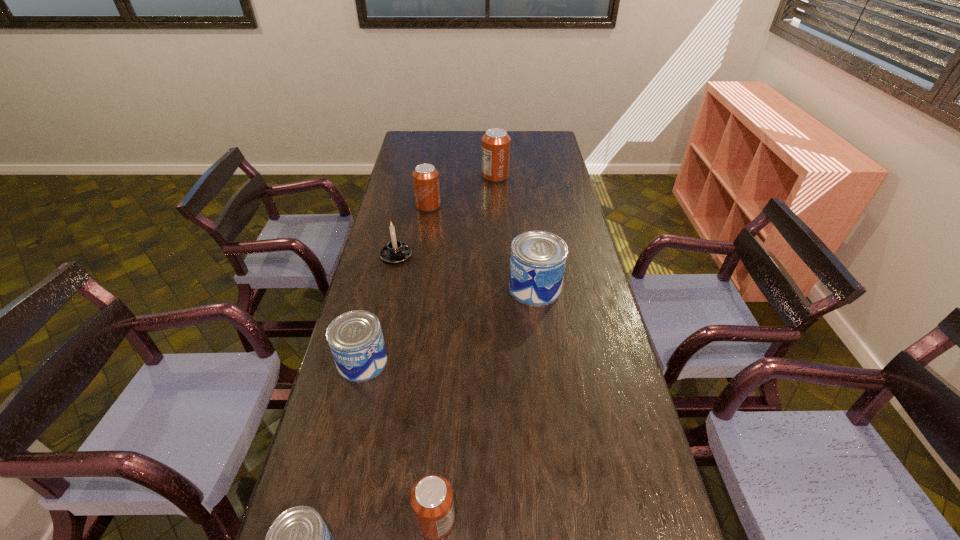
Point out which orange can is positioned as the fourth nearest to the nearest blue can. Please provide its 2D coordinates. Your answer should be formatted as a tuple, i.e. [(x, y)], where the tuple contains the x and y coordinates of a point satisfying the conditions above.

[(496, 142)]

The image size is (960, 540). Identify the location of orange can that is the closest one to the farthest orange can. (425, 177).

Identify which blue can is the second closest to the second nearest blue can. Please provide its 2D coordinates. Your answer should be formatted as a tuple, i.e. [(x, y)], where the tuple contains the x and y coordinates of a point satisfying the conditions above.

[(537, 263)]

Where is `blue can that stands as the second closest to the second nearest blue can`? blue can that stands as the second closest to the second nearest blue can is located at coordinates (537, 263).

Identify the location of vacant space that satisfies the following two spatial constraints: 1. on the front side of the farthest can; 2. with a handle on the side of the sixth nearest object. The image size is (960, 540). [x=499, y=255].